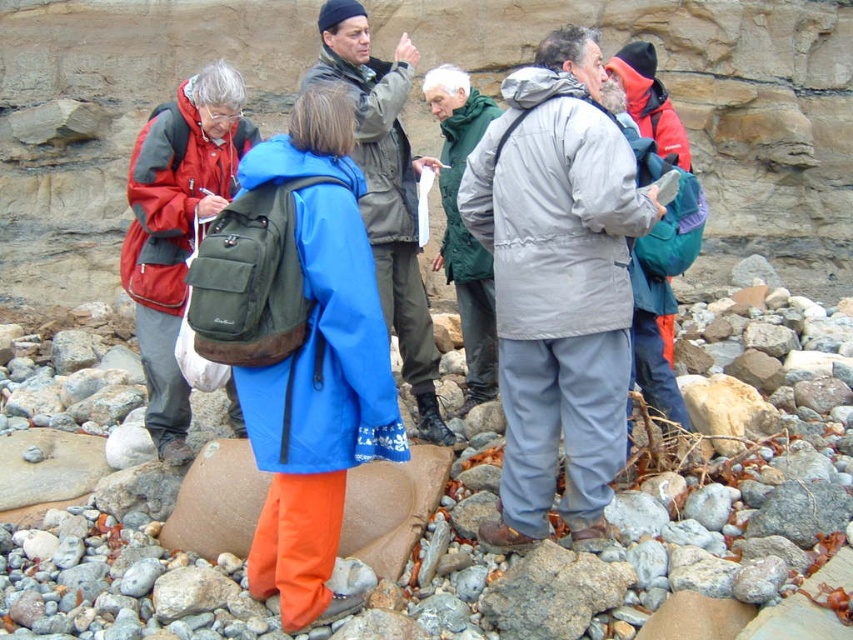
Is point (289, 160) positioned behind point (370, 76)?

No, (289, 160) is closer to viewer.

Is point (231, 339) in front of point (326, 67)?

Yes, point (231, 339) is in front of point (326, 67).

Image resolution: width=853 pixels, height=640 pixels. Describe the element at coordinates (299, 342) in the screenshot. I see `matte green backpack at center` at that location.

Identify the location of matte green backpack at center. (299, 342).

Does smooth brown rock at center appear on the left side of matte green backpack at center?

No, smooth brown rock at center is not to the left of matte green backpack at center.

Who is more distant from viewer, (165, 520) or (297, 312)?

Point (165, 520)

Image resolution: width=853 pixels, height=640 pixels. Describe the element at coordinates (619, 528) in the screenshot. I see `smooth brown rock at center` at that location.

You are a GUI agent. You are given a task and a screenshot of the screen. Output one action in this format:
    pyautogui.click(x=<x>, y=<y>)
    Task: Click on the smooth brown rock at center
    The width and height of the screenshot is (853, 640).
    Given the screenshot: What is the action you would take?
    pyautogui.click(x=619, y=528)

You are a GUI agent. You are given a task and a screenshot of the screen. Output one action in this format:
    pyautogui.click(x=<x>, y=<y>)
    Task: Click on the matte green backpack at center
    This screenshot has width=853, height=640.
    Given the screenshot: What is the action you would take?
    pyautogui.click(x=299, y=342)

Is matte green backpack at center thinner than teal fabric backpack at center?

Incorrect, matte green backpack at center's width is not less than teal fabric backpack at center's.

At what (x,y) coordinates should I click in order to perform the action: click on matte green backpack at center. Please return your answer as a coordinate pair (x, y). Looking at the image, I should click on (299, 342).